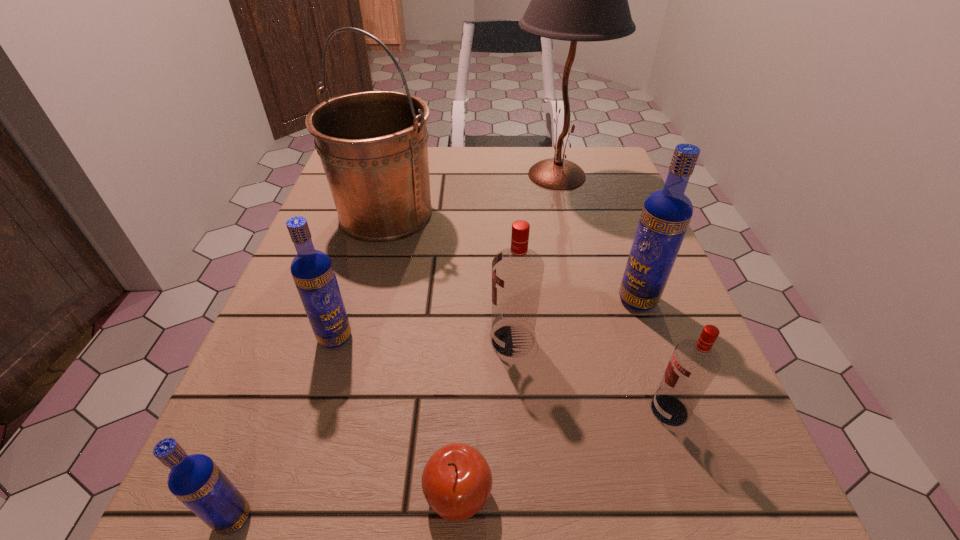
Where is `the nearest vodka`? The height and width of the screenshot is (540, 960). the nearest vodka is located at coordinates pos(195,480).

Identify the location of the smallest blue vodka. (195, 480).

This screenshot has width=960, height=540. What are the coordinates of `the fifth object from right to left` in the screenshot? It's located at (457, 481).

I want to click on the shortest object, so click(x=457, y=481).

The width and height of the screenshot is (960, 540). Identify the location of vacant position located 0.360m on the front-facing side of the tallest object. (371, 175).

I want to click on vacant space located 0.210m on the front-facing side of the tallest object, so click(x=429, y=175).

Identify the location of vacant space situated 0.200m on the front-facing side of the tallest object. (433, 175).

The height and width of the screenshot is (540, 960). In order to click on vacant region located 0.140m on the right of the bucket in this screenshot , I will do `click(499, 214)`.

I want to click on vacant region located 0.140m on the back of the sixth shortest object, so click(x=616, y=240).

I want to click on free location located 0.090m on the back of the second blue vodka from right to left, so click(350, 288).